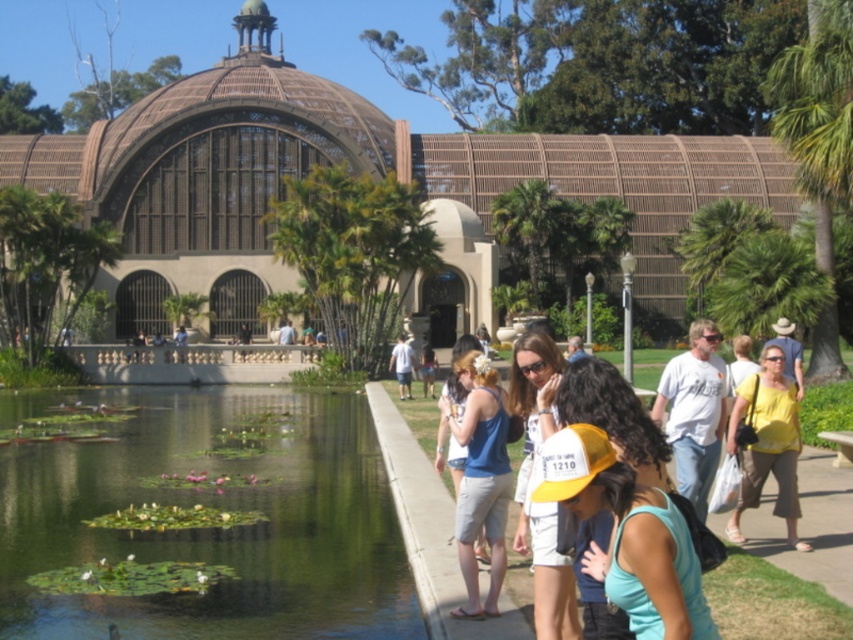
Question: Considering the relative positions of green reflective water at lower left and blue denim shorts at center in the image provided, where is green reflective water at lower left located with respect to blue denim shorts at center?

Choices:
 (A) right
 (B) left

Answer: (B)

Question: Can you confirm if blue denim shorts at center is positioned above matte white shirt at center?

Choices:
 (A) yes
 (B) no

Answer: (B)

Question: Estimate the real-world distances between objects in this image. Which object is closer to the green reflective water at lower left?

Choices:
 (A) yellow fabric cap at lower center
 (B) yellow cotton shirt at right
 (C) matte white shirt at center
 (D) white cotton t-shirt at right

Answer: (A)

Question: Is green reflective water at lower left to the right of yellow fabric cap at center from the viewer's perspective?

Choices:
 (A) no
 (B) yes

Answer: (A)

Question: Which of these objects is positioned farthest from the yellow fabric cap at lower center?

Choices:
 (A) white cotton t-shirt at right
 (B) blue denim shorts at center
 (C) green reflective water at lower left
 (D) yellow fabric cap at center

Answer: (C)

Question: Which object is positioned closest to the matte white shirt at center?

Choices:
 (A) yellow cotton shirt at right
 (B) white cotton t-shirt at right

Answer: (B)